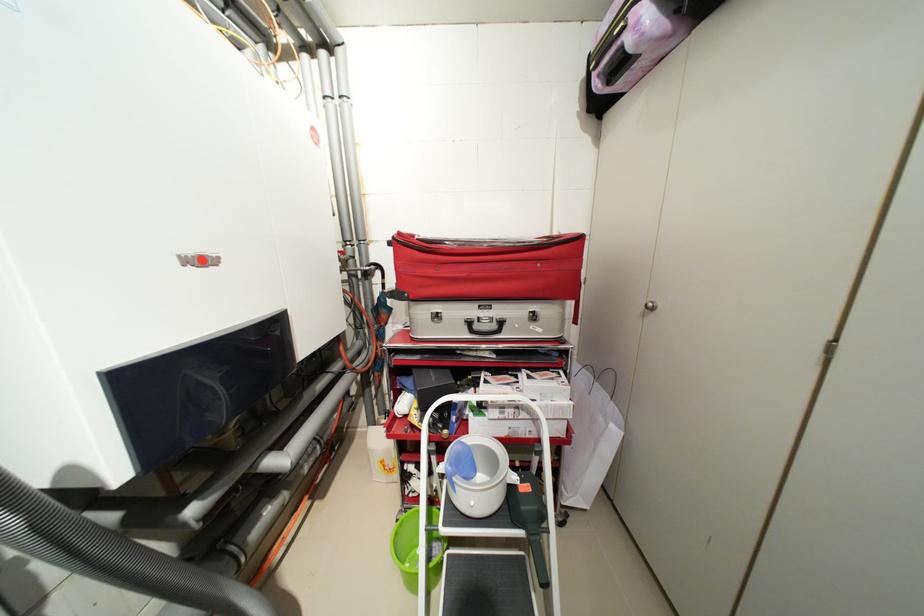
What do you see at coordinates (485, 585) in the screenshot? This screenshot has height=616, width=924. I see `the black ladder step` at bounding box center [485, 585].